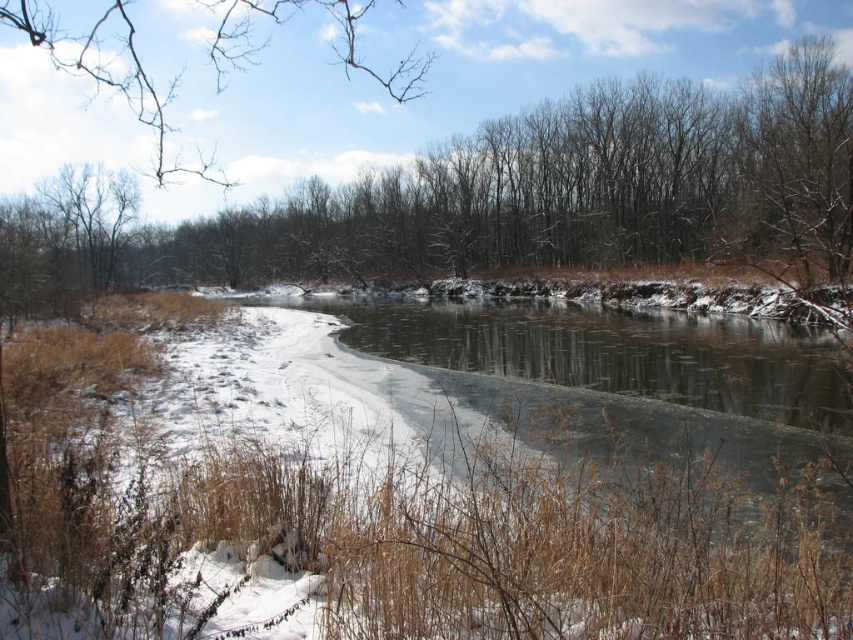
Can you confirm if brown leafless trees at center is smaller than bare branches at upper left?

Yes, brown leafless trees at center is smaller than bare branches at upper left.

Does brown leafless trees at center have a lesser height compared to bare branches at upper left?

Yes.

The image size is (853, 640). Describe the element at coordinates (502, 196) in the screenshot. I see `brown leafless trees at center` at that location.

In order to click on brown leafless trees at center in this screenshot , I will do `click(502, 196)`.